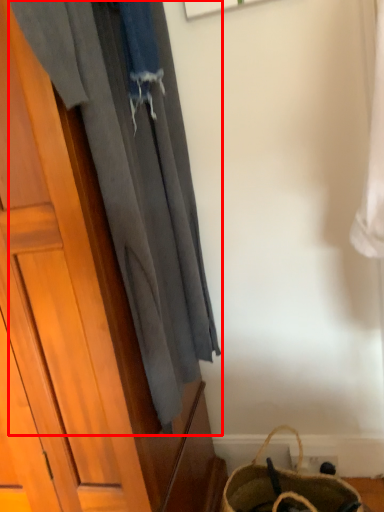
Question: From the image, what is the correct spatial relationship of curtain (annotated by the red box) in relation to handbag?

Choices:
 (A) left
 (B) right

Answer: (A)